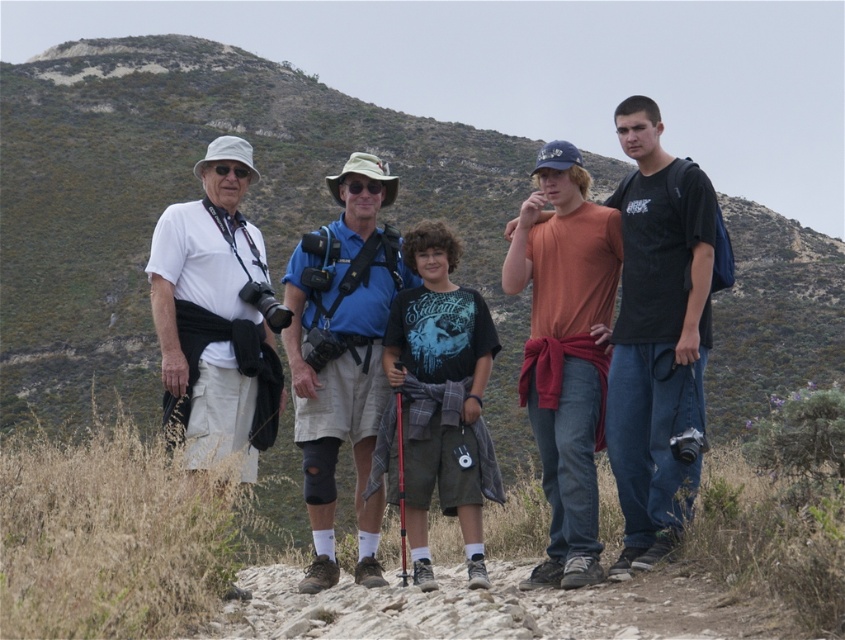
Between point (467, 522) and point (315, 300), which one is positioned in front?

Point (467, 522)

Measure the distance between matte black camera at center and blue fabric shirt at center.

They are 13.04 feet apart.

Between point (418, 499) and point (311, 336), which one is positioned in front?

Point (418, 499)

In order to click on matte black camera at center in this screenshot , I will do `click(570, 349)`.

Does matte black camera at center appear over white matte shirt at left?

Actually, matte black camera at center is below white matte shirt at left.

Describe the element at coordinates (570, 349) in the screenshot. This screenshot has height=640, width=845. I see `matte black camera at center` at that location.

This screenshot has height=640, width=845. In order to click on matte black camera at center in this screenshot , I will do `click(570, 349)`.

Is blue fabric shirt at center taller than dark blue t-shirt at center?

Indeed, blue fabric shirt at center has a greater height compared to dark blue t-shirt at center.

Is point (334, 198) farther from viewer compared to point (422, 326)?

Yes, point (334, 198) is farther from viewer.

Locate an element on the screen. blue fabric shirt at center is located at coordinates (342, 355).